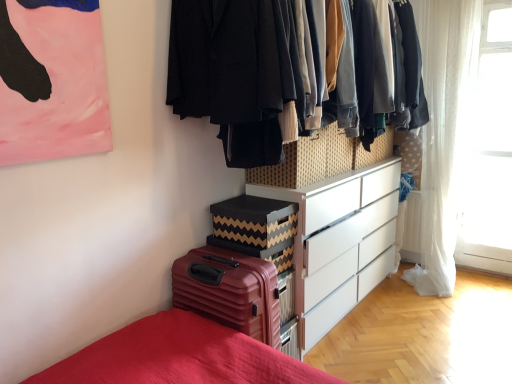
The width and height of the screenshot is (512, 384). What are the coordinates of `vacant area situated below white sheer curtain at right (from a real-world perspective)` in the screenshot? It's located at (480, 271).